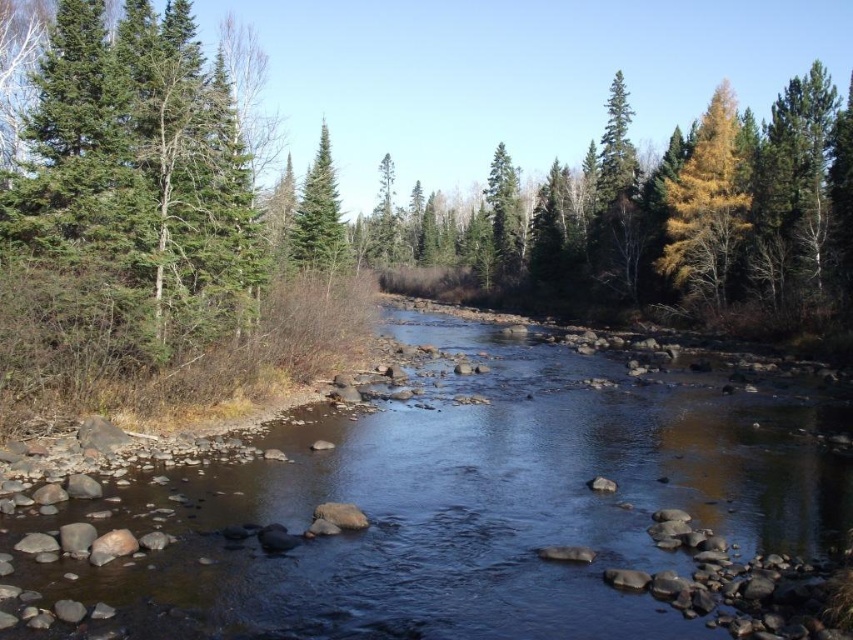
Does yellow/golden wood at upper right have a greater height compared to green matte tree at center?

Yes.

Is yellow/golden wood at upper right closer to the viewer compared to green matte tree at center?

No.

Locate an element on the screen. yellow/golden wood at upper right is located at coordinates (706, 208).

At what (x,y) coordinates should I click in order to perform the action: click on yellow/golden wood at upper right. Please return your answer as a coordinate pair (x, y). Looking at the image, I should click on (706, 208).

Which is more to the right, smooth rock stream at center or yellow/golden wood at upper right?

yellow/golden wood at upper right is more to the right.

Can you confirm if smooth rock stream at center is thinner than yellow/golden wood at upper right?

Incorrect, smooth rock stream at center's width is not less than yellow/golden wood at upper right's.

Describe the element at coordinates (467, 508) in the screenshot. I see `smooth rock stream at center` at that location.

Image resolution: width=853 pixels, height=640 pixels. What are the coordinates of `smooth rock stream at center` in the screenshot? It's located at (467, 508).

Measure the distance between smooth rock stream at center and camera.

smooth rock stream at center is 9.82 meters from camera.

Between point (294, 589) and point (323, 225), which one is positioned behind?

Positioned behind is point (323, 225).

Find the location of a particular element. smooth rock stream at center is located at coordinates (467, 508).